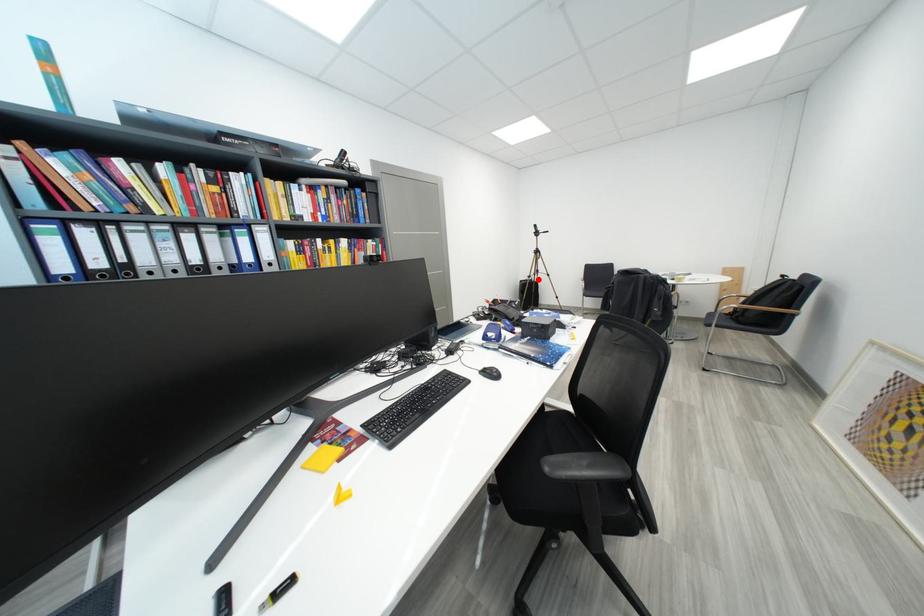
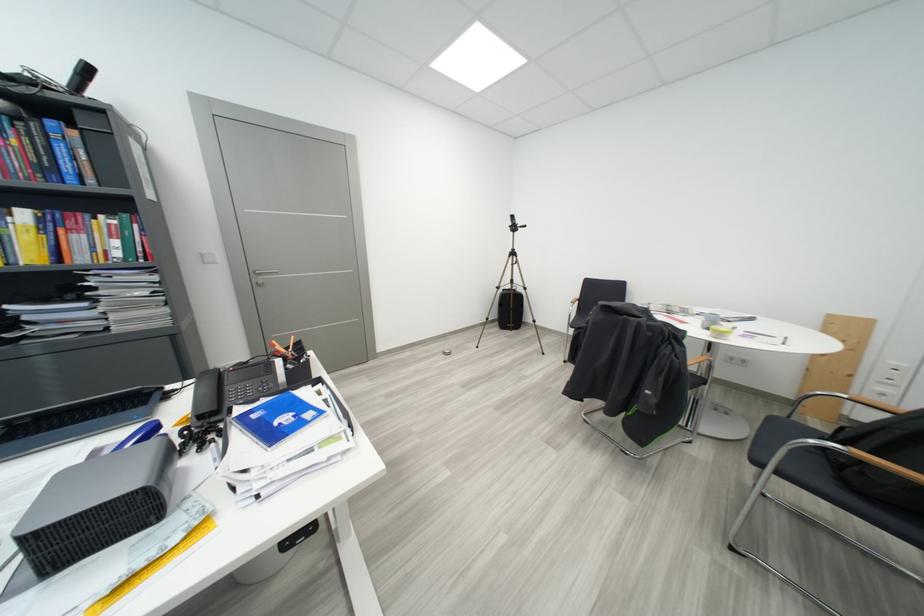
Locate, in the second image, the point that corresponds to the highlighted location in the first image.

(506, 291)